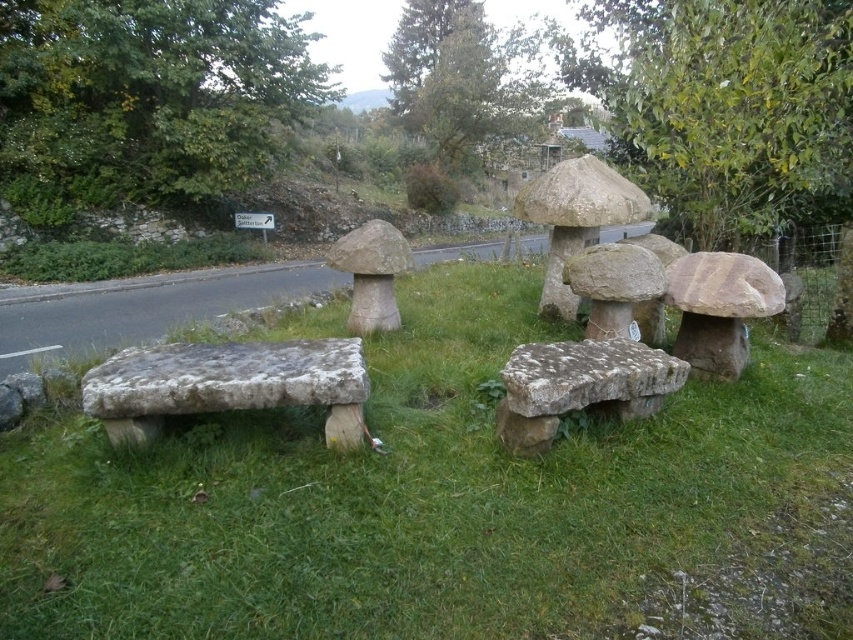
Question: Which object is closer to the camera taking this photo?

Choices:
 (A) green mossy stone bench at center
 (B) gray stone bench at lower left

Answer: (A)

Question: Among these points, which one is farthest from the camera?

Choices:
 (A) (115, 435)
 (B) (415, 316)

Answer: (B)

Question: Does green mossy stone bench at center appear on the left side of gray stone bench at lower left?

Choices:
 (A) yes
 (B) no

Answer: (B)

Question: Can you confirm if green mossy stone bench at center is positioned to the right of gray stone bench at lower left?

Choices:
 (A) yes
 (B) no

Answer: (A)

Question: Is gray stone bench at lower left below speckled stone bench at center?

Choices:
 (A) no
 (B) yes

Answer: (A)

Question: Which point is closer to the camera?

Choices:
 (A) (387, 432)
 (B) (260, 394)

Answer: (B)